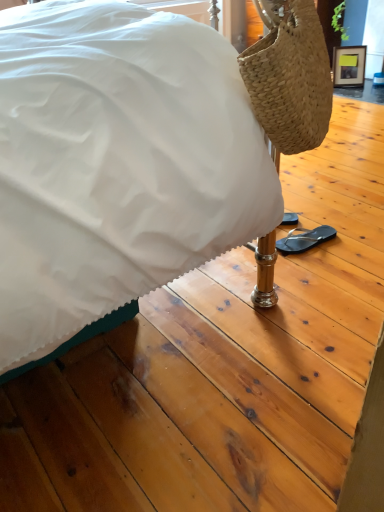
Question: Should I look upward or downward to see natural woven handbag at right?

Choices:
 (A) down
 (B) up

Answer: (B)